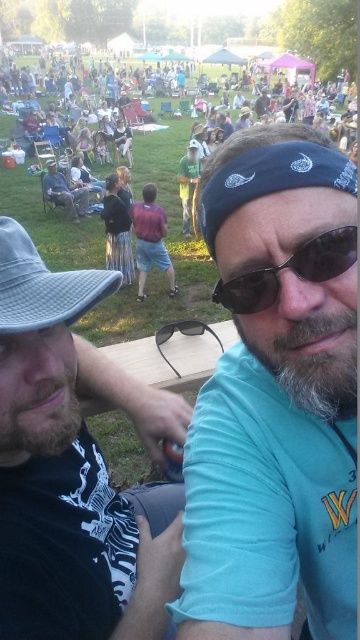
Describe the element at coordinates (62, 454) in the screenshot. I see `beige fabric hat at left` at that location.

In the scene shown: Measure the distance between beige fabric hat at left and camera.

beige fabric hat at left and camera are 82.28 centimeters apart from each other.

Find the location of a particular element. beige fabric hat at left is located at coordinates pyautogui.click(x=62, y=454).

Is blue bandana at center to the left of gray fabric baseball hat at left from the viewer's perspective?

Incorrect, blue bandana at center is not on the left side of gray fabric baseball hat at left.

Does blue bandana at center have a greater width compared to gray fabric baseball hat at left?

Correct, the width of blue bandana at center exceeds that of gray fabric baseball hat at left.

Between point (271, 376) and point (15, 298), which one is positioned in front?

Point (15, 298)

Identify the location of blue bandana at center. (276, 396).

In the scene shown: Who is positioned more to the right, graywoollybeard at center or sunglasses at center?

Positioned to the right is graywoollybeard at center.

Between graywoollybeard at center and sunglasses at center, which one has more height?

Standing taller between the two is graywoollybeard at center.

Does point (356, 381) lie behind point (351, 237)?

Yes, point (356, 381) is behind point (351, 237).

The height and width of the screenshot is (640, 360). Identify the location of graywoollybeard at center. (309, 358).